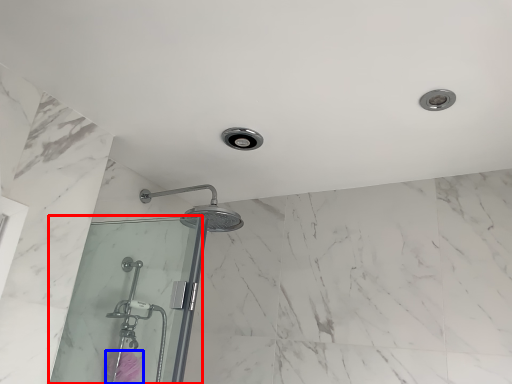
Question: Which point is further to the camera, screen door (highlighted by a red box) or flower (highlighted by a blue box)?

Choices:
 (A) screen door
 (B) flower

Answer: (B)